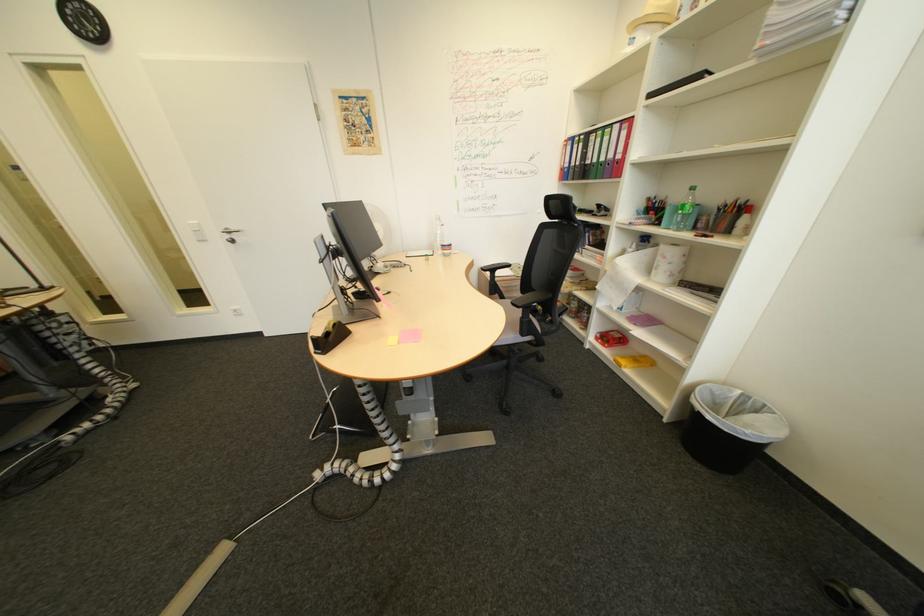
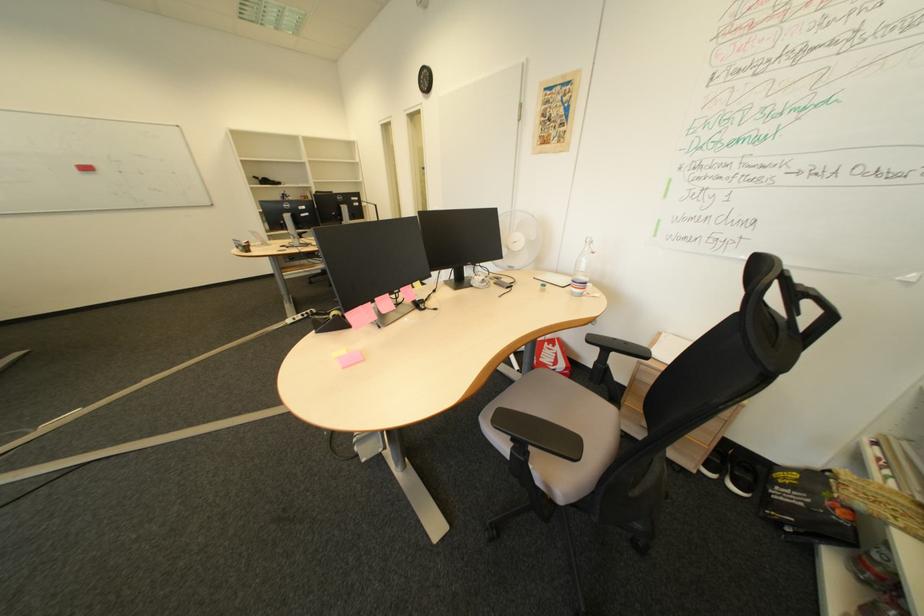
Locate, in the second image, the point that corresponds to the point at 456,246 in the first image.

(587, 282)